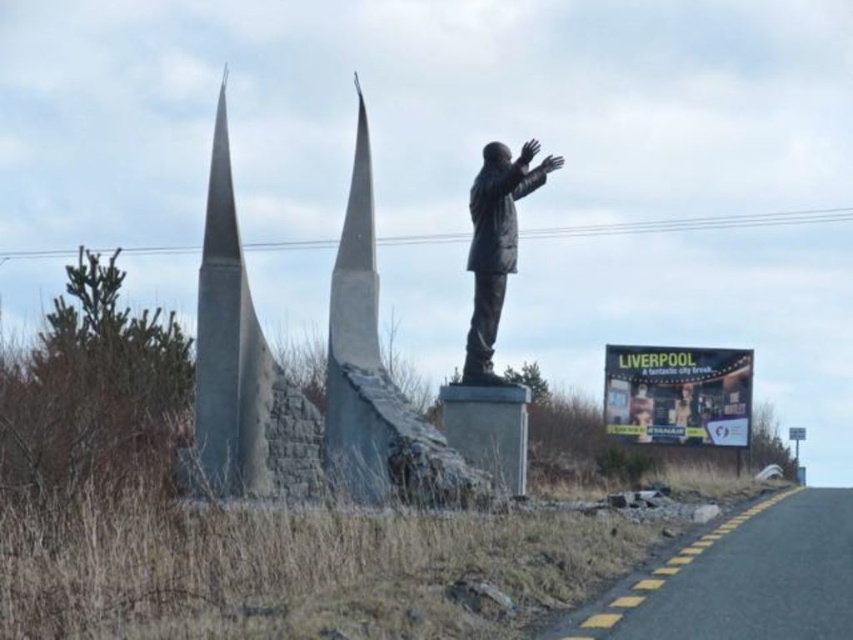
You are standing at the point marked by the coordinates point at (677,394). Looking around, you see the statue of a person standing with arms raised on a pedestal and two gray rocket structures to the left. Which direction should you walk to reach the yellow billboard at right?

The point at (677,394) indicates the yellow billboard at right, so you are already at the yellow billboard at right. Therefore, you don not need to move further in any direction to reach it.

You are standing in the outdoor scene with the statue and the two rocket structures. You notice two points marked in the image. Which of the two points, point (619, 381) or point (474, 355), is closer to you?

Point (619, 381) is further to the viewer than point (474, 355), so the closer point to you is point (474, 355).